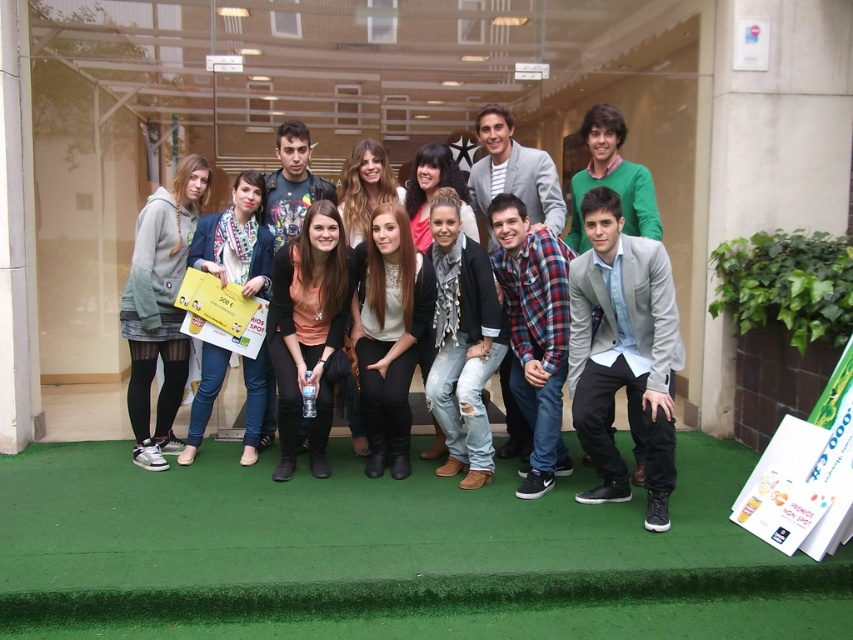
You are a photographer trying to adjust the focus of your camera. You want to ensure both the ripped denim jeans at center and the denim jacket at center are in focus. Which object should you focus on first to achieve this?

You should focus on the denim jacket at center first because the ripped denim jeans at center is in front of it, so focusing on the farther object first will allow both to be in focus.

You are a photographer trying to capture a closeup of the ripped denim jeans at center and denim jacket at center. Since you can only focus on one item at a time, which one should you aim for first if you want to capture both without moving the camera?

You should aim for the denim jacket at center first because the ripped denim jeans at center is to the right of it. By focusing on the denim jacket at center first, you can then adjust slightly to the right to capture the ripped denim jeans at center without moving the camera.